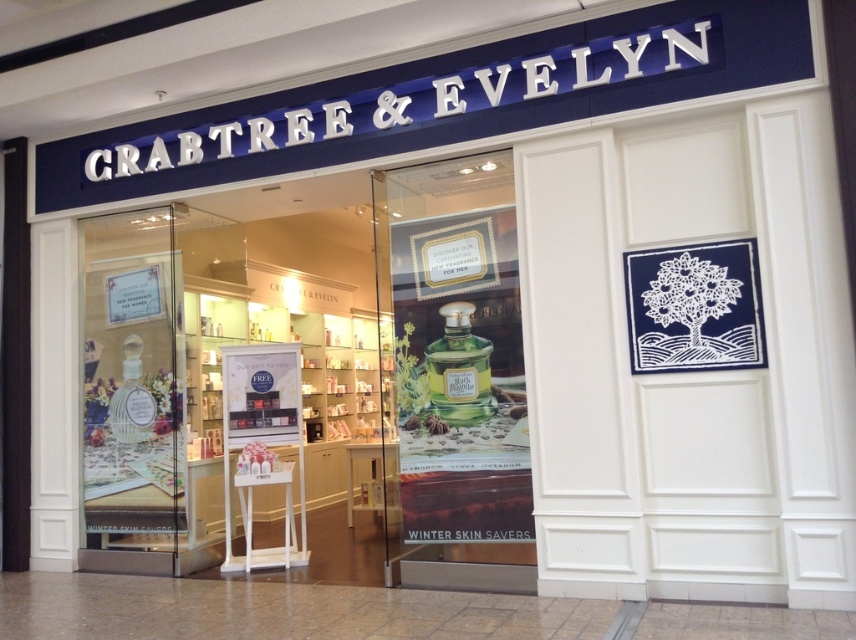
Does point (438, 284) lie in front of point (467, 552)?

No, it is not.

Between green glass perfume bottle at center and green glass bottle at center, which one appears on the left side from the viewer's perspective?

green glass perfume bottle at center

Find the location of a particular element. green glass perfume bottle at center is located at coordinates (312, 380).